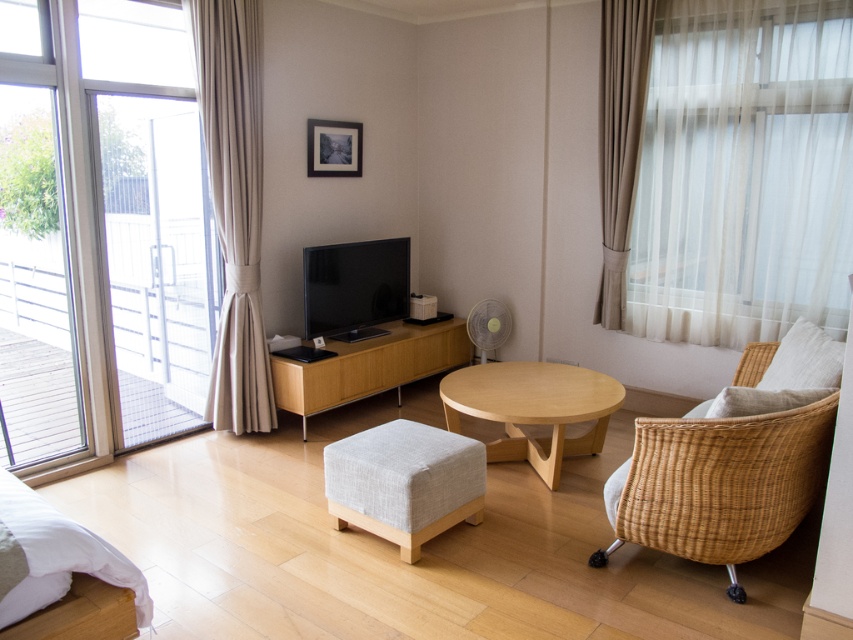
You are standing in the center of the room and want to exit to the balcony. Which direction should you walk towards the clear glass door at left to reach the balcony?

You should walk towards the clear glass door at left, which is located at point (100, 230), to reach the balcony.

You are moving a large sofa that is 1.5 meters wide into the living room. You need to pass through the clear glass door at left and the transparent glass door at left. Which door should you use to ensure the sofa can fit through?

The clear glass door at left has a larger width than the transparent glass door at left, so you should use the clear glass door at left to move the sofa through since it can accommodate the sofa width of 1.5 meters.